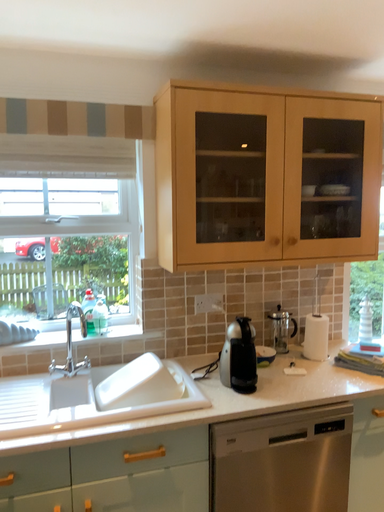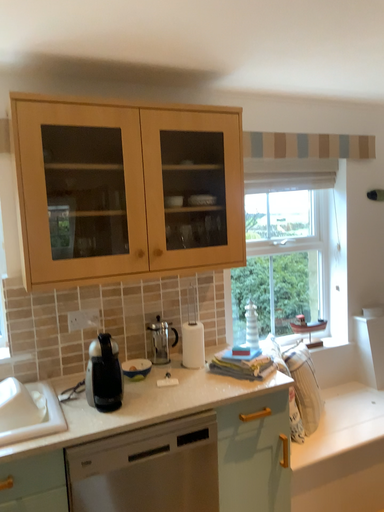
Question: Which way did the camera rotate in the video?

Choices:
 (A) rotated left
 (B) rotated right

Answer: (B)